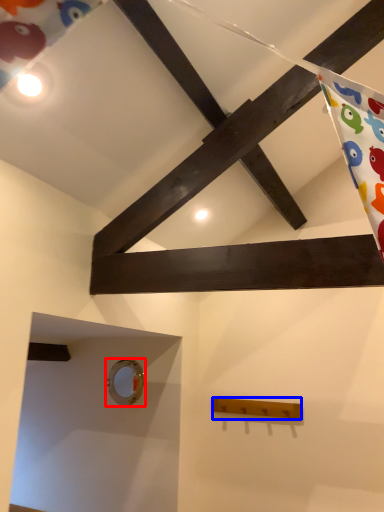
Question: Among these objects, which one is nearest to the camera, hole (highlighted by a red box) or plank (highlighted by a blue box)?

Choices:
 (A) hole
 (B) plank

Answer: (B)